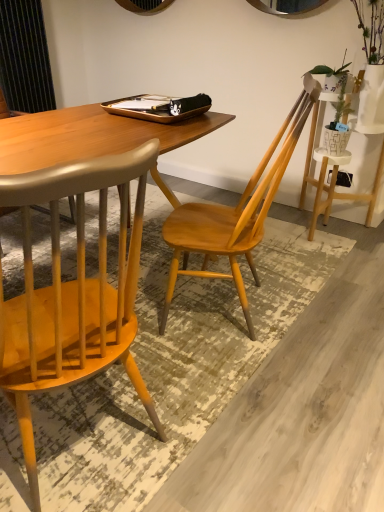
Question: Is point (87, 343) positioned closer to the camera than point (241, 232)?

Choices:
 (A) closer
 (B) farther

Answer: (A)

Question: From the image's perspective, is wooden chair at left, positioned as the 2th chair in right-to-left order, above or below light wood chair at center, the second chair in the left-to-right sequence?

Choices:
 (A) above
 (B) below

Answer: (B)

Question: Considering the relative positions of wooden chair at left, which is counted as the first chair, starting from the left, and light wood chair at center, the second chair in the left-to-right sequence, in the image provided, is wooden chair at left, which is counted as the first chair, starting from the left, to the left or to the right of light wood chair at center, the second chair in the left-to-right sequence,?

Choices:
 (A) right
 (B) left

Answer: (B)

Question: Is light wood chair at center, the first chair from the right, taller or shorter than wooden chair at left, which is counted as the first chair, starting from the left?

Choices:
 (A) tall
 (B) short

Answer: (A)

Question: Which is correct: light wood chair at center, the first chair from the right, is inside wooden chair at left, which is counted as the first chair, starting from the left, or outside of it?

Choices:
 (A) outside
 (B) inside

Answer: (A)

Question: Considering the positions of light wood chair at center, the second chair in the left-to-right sequence, and wooden chair at left, positioned as the 2th chair in right-to-left order, in the image, is light wood chair at center, the second chair in the left-to-right sequence, bigger or smaller than wooden chair at left, positioned as the 2th chair in right-to-left order,?

Choices:
 (A) small
 (B) big

Answer: (A)

Question: Relative to wooden chair at left, which is counted as the first chair, starting from the left, is light wood chair at center, the first chair from the right, in front or behind?

Choices:
 (A) behind
 (B) front

Answer: (A)